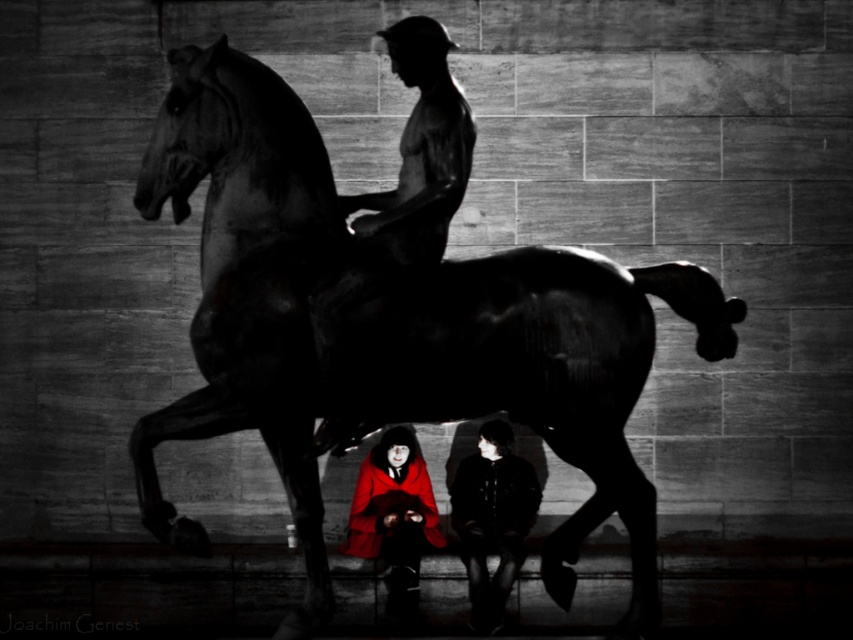
Question: Among these objects, which one is farthest from the camera?

Choices:
 (A) smooth dark skin at center
 (B) black polished statue at center

Answer: (A)

Question: Is black polished statue at center below smooth dark skin at center?

Choices:
 (A) no
 (B) yes

Answer: (B)

Question: Which point appears closest to the camera in this image?

Choices:
 (A) [x=432, y=502]
 (B) [x=456, y=524]

Answer: (A)

Question: Considering the relative positions of smooth dark skin at center and red velvet cloak at center in the image provided, where is smooth dark skin at center located with respect to red velvet cloak at center?

Choices:
 (A) right
 (B) left

Answer: (A)

Question: Is smooth dark skin at center wider than black leather jacket at lower center?

Choices:
 (A) yes
 (B) no

Answer: (A)

Question: Which point is farther to the camera?

Choices:
 (A) (392, 588)
 (B) (508, 506)
 (C) (213, 192)

Answer: (B)